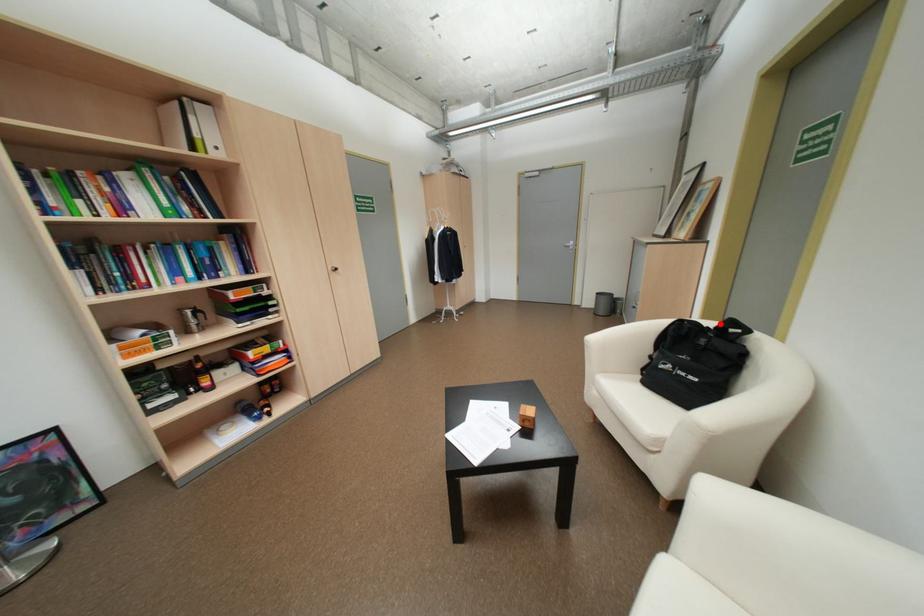
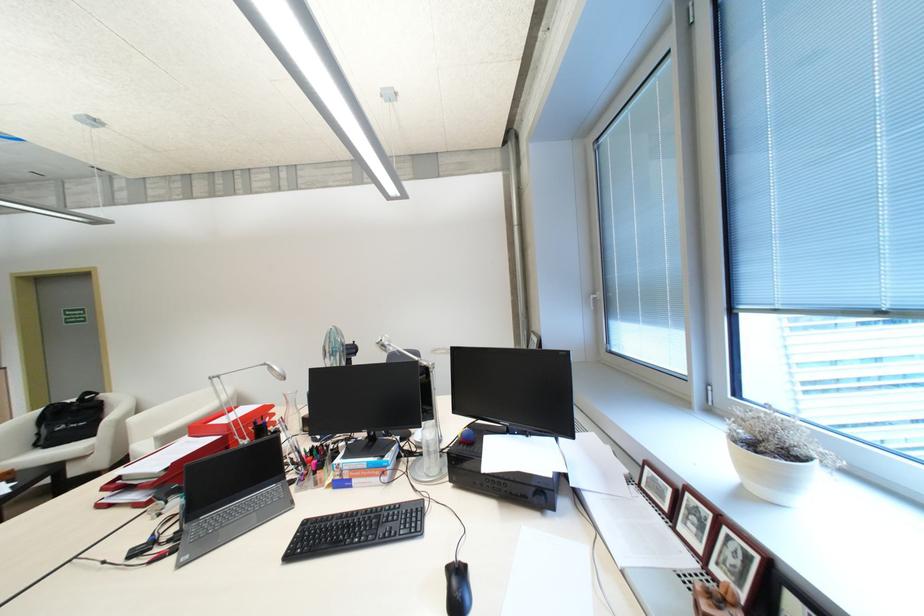
Question: I am providing you with two images of the same scene from different viewpoints. A red point is shown in image1. For the corresponding object point in image2, is it positioned nearer or farther from the camera?

Choices:
 (A) Nearer
 (B) Farther

Answer: (B)